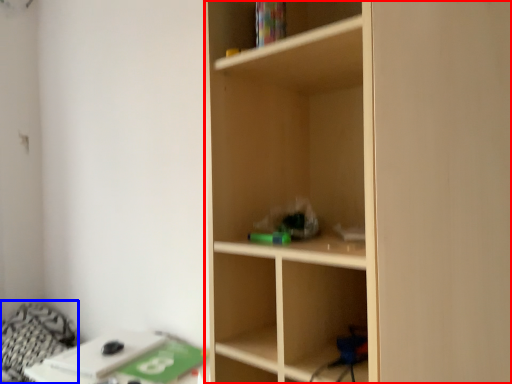
Question: Which object is closer to the camera taking this photo, shelf (highlighted by a red box) or bedding (highlighted by a blue box)?

Choices:
 (A) shelf
 (B) bedding

Answer: (A)